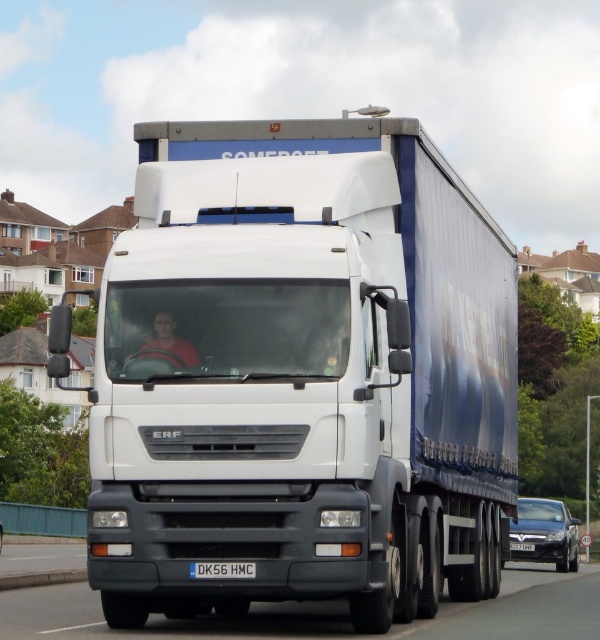
You are a delivery driver who needs to check the license plate of the ERF truck from your current position. The license plate is located at the center of the truck. Given that the black plastic license plate at center is 12.02 meters away from you, can you read the license plate number clearly without moving closer?

The black plastic license plate at center is 12.02 meters away from the viewer. At this distance, it may be difficult to read the license plate number clearly without moving closer.

You are a delivery driver who needs to pass under a low bridge. The white matte truck at center and the black rubber highway at center are in your path. Based on their heights, which one might block your passage?

The white matte truck at center is much taller than the black rubber highway at center, so the white matte truck at center would block your passage under the low bridge.